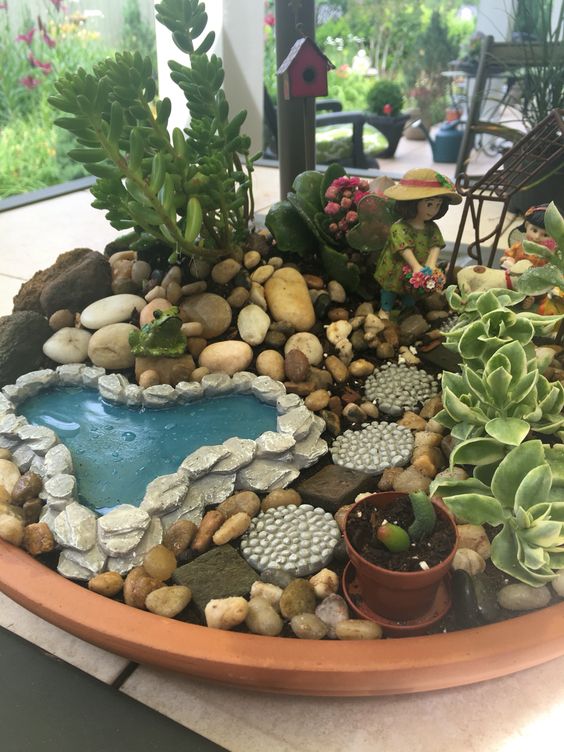
The width and height of the screenshot is (564, 752). What are the coordinates of `back of chair` in the screenshot? It's located at (502, 56).